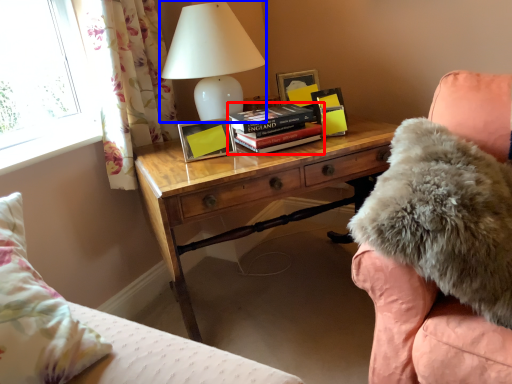
Question: Among these objects, which one is nearest to the camera, book (highlighted by a red box) or table lamp (highlighted by a blue box)?

Choices:
 (A) book
 (B) table lamp

Answer: (B)